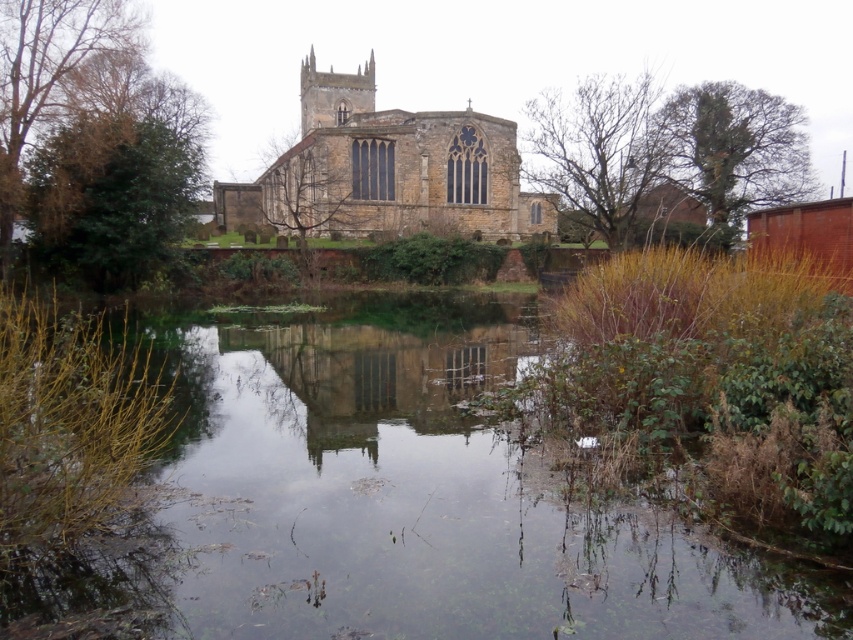
You are an architect analyzing the image of the historic stone church and its reflection on the water. According to the scene, which object is wider between the brown stone church at center and the smooth stone church at center?

The brown stone church at center is wider than the smooth stone church at center.

You are a photographer planning to capture the reflection of the smooth stone church at center in the water. However, there is a green leafy tree at left in the scene. Based on their positions, will the tree block the reflection of the church in the water?

The green leafy tree at left is located above the smooth stone church at center, so its reflection would overlap with the church reflection, blocking it from view.

You are planning to take a photo of the smooth stone church at center and the green leafy tree at left. To ensure both are fully visible in your frame, which object should you focus on first considering their sizes?

The green leafy tree at left is narrower than the smooth stone church at center, so you should focus on the smooth stone church at center first to ensure it fits properly in the frame.